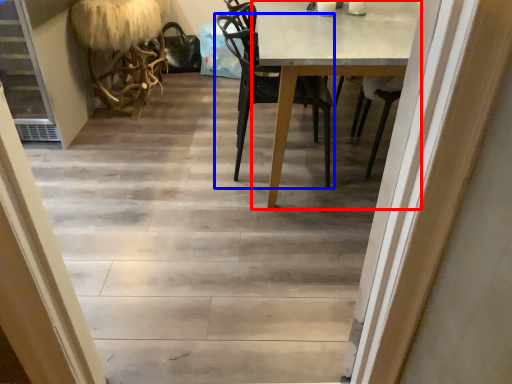
Question: Which point is closer to the camera, round table (highlighted by a red box) or chair (highlighted by a blue box)?

Choices:
 (A) round table
 (B) chair

Answer: (A)